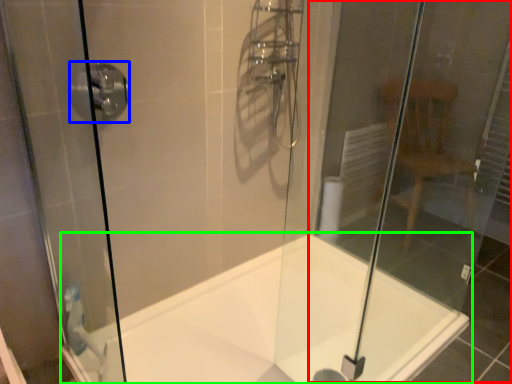
Question: Based on their relative distances, which object is nearer to glass door (highlighted by a red box)? Choose from shower (highlighted by a blue box) and bathtub (highlighted by a green box).

Choices:
 (A) shower
 (B) bathtub

Answer: (B)